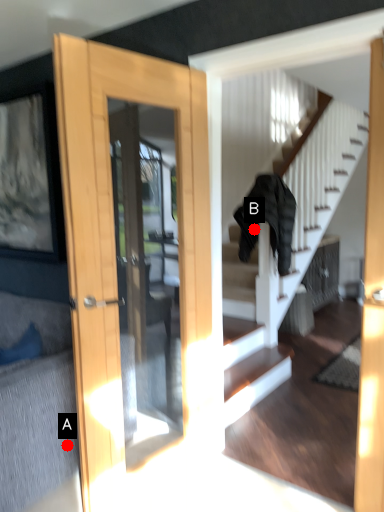
Question: Two points are circled on the image, labeled by A and B beside each circle. Which point appears closest to the camera in this image?

Choices:
 (A) A is closer
 (B) B is closer

Answer: (A)